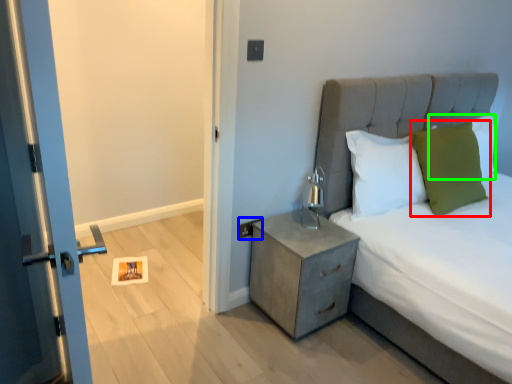
Question: Which object is positioned farthest from pillow (highlighted by a red box)? Select from electric outlet (highlighted by a blue box) and pillow (highlighted by a green box).

Choices:
 (A) electric outlet
 (B) pillow

Answer: (A)